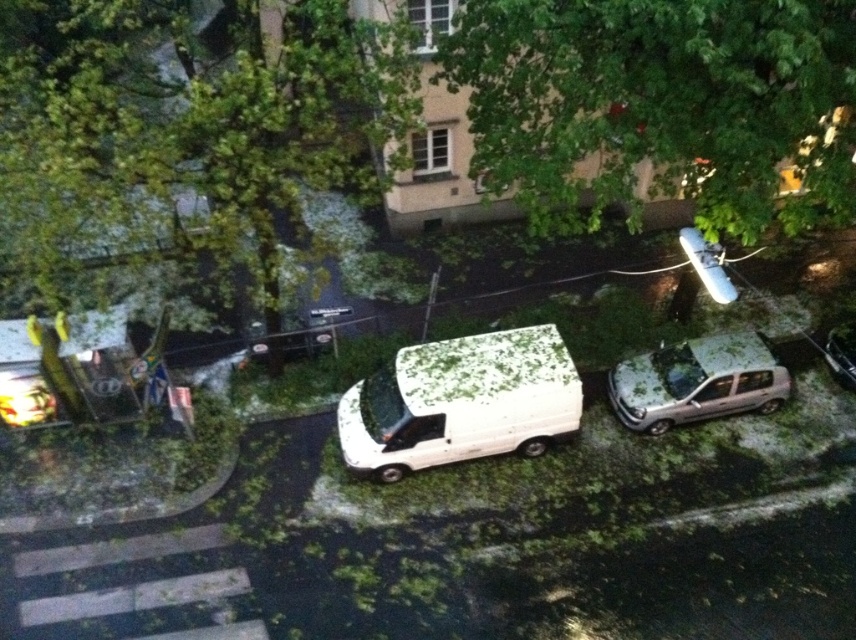
You are a delivery person trying to navigate through the storm debris on the road. You see the green leafy tree at upper left and the metallic silver surfboard at upper right. Which object is positioned higher in the image?

The green leafy tree at upper left is located above the metallic silver surfboard at upper right, so it is positioned higher in the image.